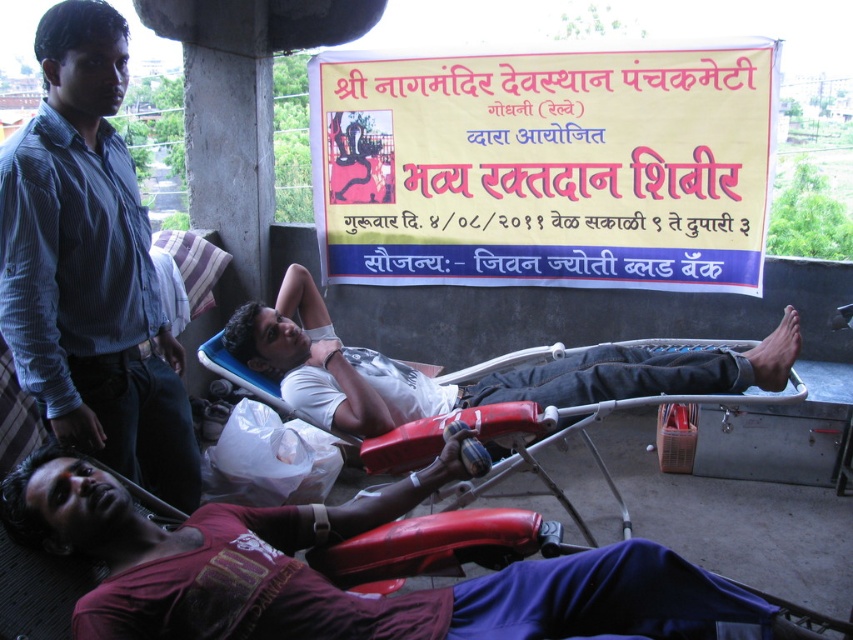
Is yellow paper banner at upper center positioned behind white matte t-shirt at center?

That is True.

Is yellow paper banner at upper center below white matte t-shirt at center?

Actually, yellow paper banner at upper center is above white matte t-shirt at center.

I want to click on yellow paper banner at upper center, so click(x=544, y=168).

Can you confirm if maroon cotton shirt at lower left is shorter than blue striped shirt at upper left?

Yes.

Is point (154, 536) positioned after point (62, 116)?

No, (154, 536) is in front of (62, 116).

Which is in front, point (194, 604) or point (18, 365)?

Positioned in front is point (194, 604).

Locate an element on the screen. The image size is (853, 640). maroon cotton shirt at lower left is located at coordinates (335, 586).

Can you confirm if maroon cotton shirt at lower left is taller than white matte t-shirt at center?

No, maroon cotton shirt at lower left is not taller than white matte t-shirt at center.

Which is in front, point (210, 612) or point (634, 362)?

Point (210, 612) is more forward.

Find the location of a particular element. This screenshot has height=640, width=853. maroon cotton shirt at lower left is located at coordinates (335, 586).

Where is `maroon cotton shirt at lower left`? This screenshot has height=640, width=853. maroon cotton shirt at lower left is located at coordinates (335, 586).